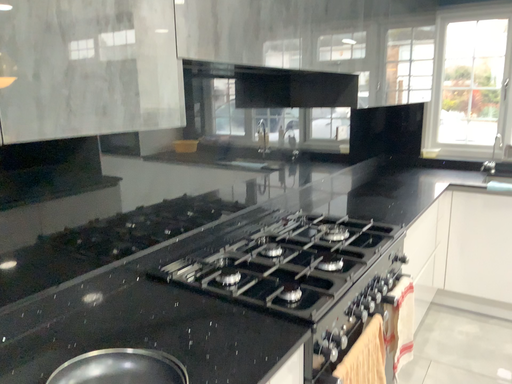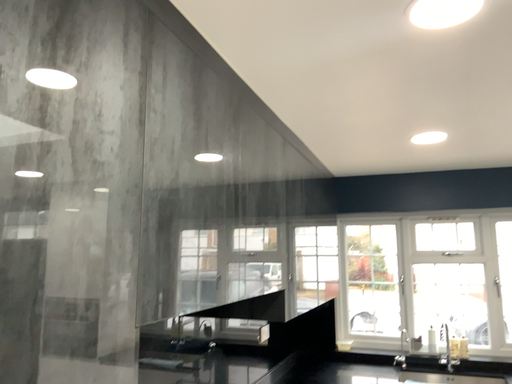
Question: How did the camera likely rotate when shooting the video?

Choices:
 (A) rotated upward
 (B) rotated downward

Answer: (A)